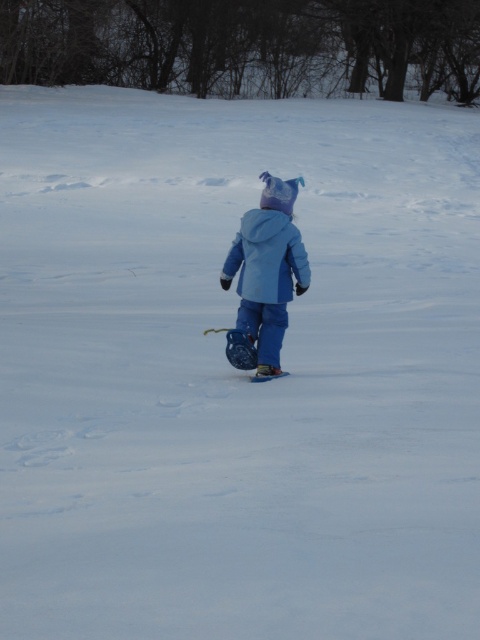
Question: Is matte blue snowsuit at center thinner than matte blue jacket at center?

Choices:
 (A) no
 (B) yes

Answer: (B)

Question: Does matte blue snowsuit at center have a larger size compared to matte blue jacket at center?

Choices:
 (A) yes
 (B) no

Answer: (A)

Question: Does matte blue snowsuit at center come behind matte blue jacket at center?

Choices:
 (A) no
 (B) yes

Answer: (A)

Question: Which of the following is the closest to the observer?

Choices:
 (A) (260, 364)
 (B) (256, 256)

Answer: (B)

Question: Which of the following is the closest to the observer?

Choices:
 (A) matte blue jacket at center
 (B) matte blue snowsuit at center

Answer: (B)